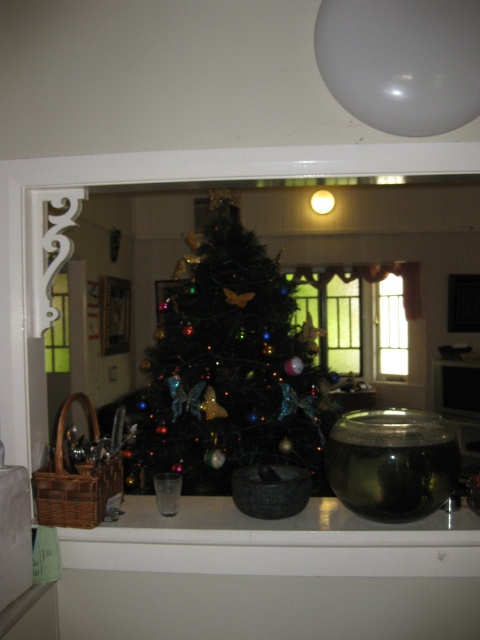
You are standing in the kitchen and want to take a photo of the shiny green christmas tree at center through the doorway. Based on its position, where should you aim your camera to capture it best?

The shiny green christmas tree at center is located at point 0.577 along the horizontal axis and 0.477 along the vertical axis, so aim your camera slightly to the right and lower to capture it best.

You are standing in the kitchen and want to take a photo of the shiny green christmas tree at center through the translucent glass window at center. Which object should be closer to the camera to ensure the tree is visible in the photo?

The shiny green christmas tree at center is to the left of the translucent glass window at center, so the tree must be closer to the camera than the window to be visible in the photo.